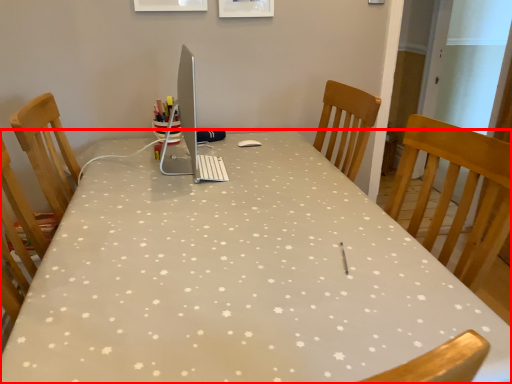
Question: From the image, what is the correct spatial relationship of table (annotated by the red box) in relation to desktop computer?

Choices:
 (A) left
 (B) right

Answer: (B)